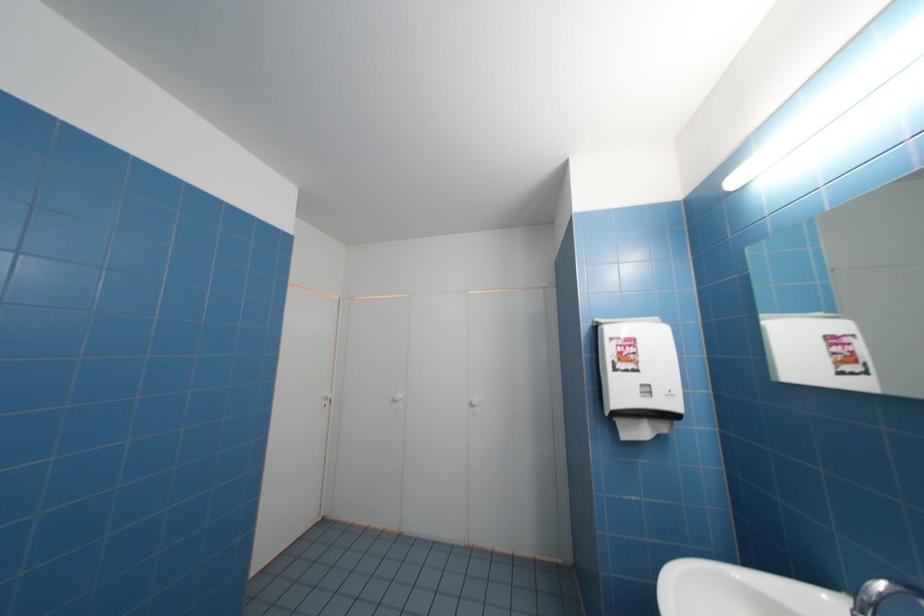
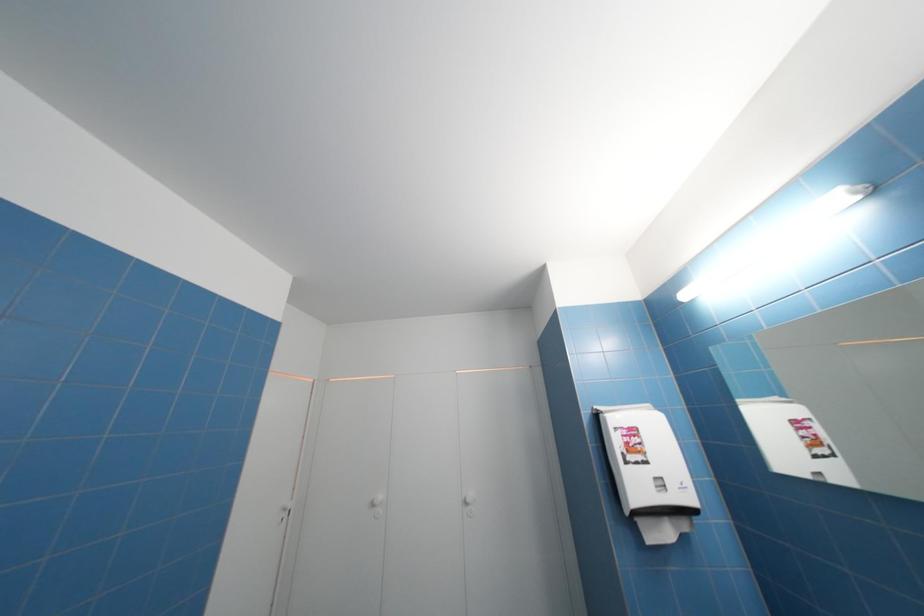
Question: In a continuous first-person perspective shot, in which direction is the camera moving?

Choices:
 (A) Left
 (B) Right
 (C) Forward
 (D) Backward

Answer: (A)